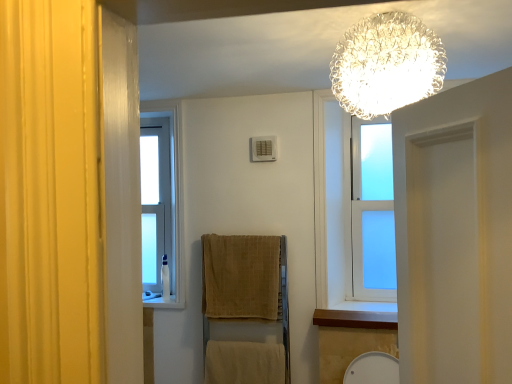
Question: Which direction should I rotate to look at beige cotton towel at lower center, placed as the second bath towel when sorted from top to bottom?

Choices:
 (A) left
 (B) right

Answer: (A)

Question: Is beige textured towel at center, which is counted as the 1th bath towel, starting from the top, turned away from white plastic toiletry at left?

Choices:
 (A) no
 (B) yes

Answer: (A)

Question: Is beige textured towel at center, positioned as the 2th bath towel in bottom-to-top order, positioned in front of white plastic toiletry at left?

Choices:
 (A) yes
 (B) no

Answer: (A)

Question: Considering the relative sizes of beige textured towel at center, which is counted as the 1th bath towel, starting from the top, and white plastic toiletry at left in the image provided, is beige textured towel at center, which is counted as the 1th bath towel, starting from the top, wider than white plastic toiletry at left?

Choices:
 (A) no
 (B) yes

Answer: (B)

Question: Is beige textured towel at center, positioned as the 2th bath towel in bottom-to-top order, at the right side of white plastic toiletry at left?

Choices:
 (A) yes
 (B) no

Answer: (A)

Question: Is beige textured towel at center, which is counted as the 1th bath towel, starting from the top, far away from white plastic toiletry at left?

Choices:
 (A) yes
 (B) no

Answer: (B)

Question: From the image's perspective, is beige textured towel at center, positioned as the 2th bath towel in bottom-to-top order, below white plastic toiletry at left?

Choices:
 (A) yes
 (B) no

Answer: (B)

Question: Is beige textured towel at center, which is counted as the 1th bath towel, starting from the top, to the left of wooden at lower right from the viewer's perspective?

Choices:
 (A) yes
 (B) no

Answer: (A)

Question: Is beige textured towel at center, which is counted as the 1th bath towel, starting from the top, taller than wooden at lower right?

Choices:
 (A) no
 (B) yes

Answer: (B)

Question: Is beige textured towel at center, which is counted as the 1th bath towel, starting from the top, positioned with its back to wooden at lower right?

Choices:
 (A) no
 (B) yes

Answer: (A)

Question: Is beige textured towel at center, positioned as the 2th bath towel in bottom-to-top order, completely or partially outside of wooden at lower right?

Choices:
 (A) no
 (B) yes

Answer: (B)

Question: Can you confirm if beige textured towel at center, positioned as the 2th bath towel in bottom-to-top order, is smaller than wooden at lower right?

Choices:
 (A) no
 (B) yes

Answer: (A)

Question: Is wooden at lower right surrounded by beige textured towel at center, positioned as the 2th bath towel in bottom-to-top order?

Choices:
 (A) yes
 (B) no

Answer: (B)

Question: Are beige cotton towel at lower center, placed as the first bath towel when sorted from bottom to top, and wooden at lower right located far from each other?

Choices:
 (A) yes
 (B) no

Answer: (B)